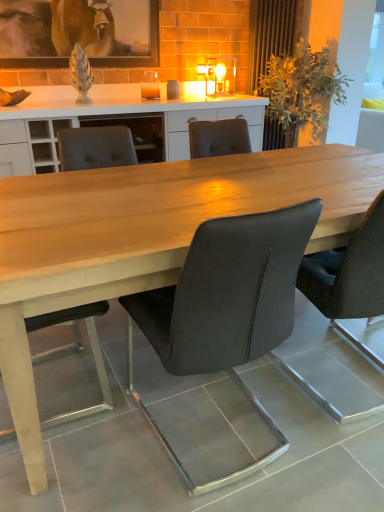
Where is `blank space situated above light wood table at center (from a real-world perspective)`? blank space situated above light wood table at center (from a real-world perspective) is located at coordinates (230, 175).